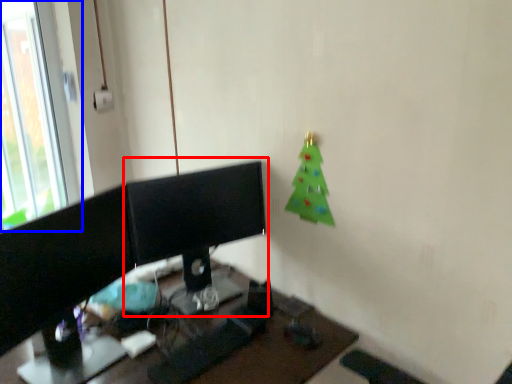
Question: Among these objects, which one is farthest to the camera, desktop computer (highlighted by a red box) or window (highlighted by a blue box)?

Choices:
 (A) desktop computer
 (B) window

Answer: (B)